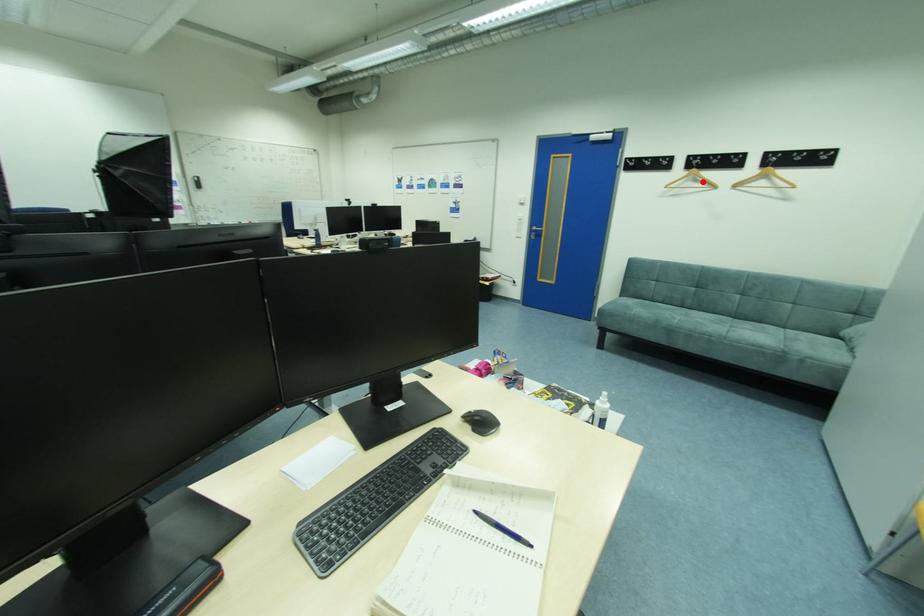
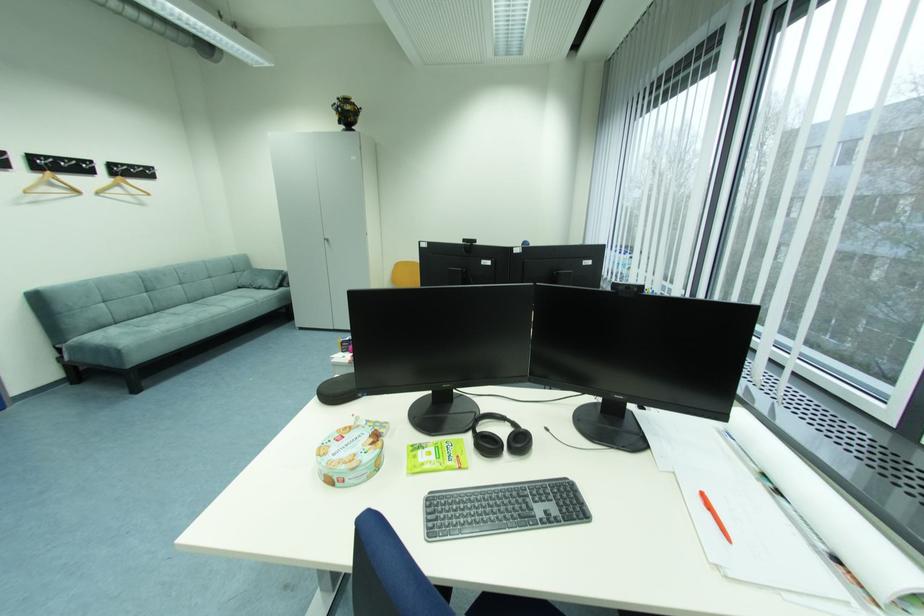
Question: I am providing you with two images of the same scene from different viewpoints. Given a red point in image1, look at the same physical point in image2. Is it:

Choices:
 (A) Closer to the viewpoint
 (B) Farther from the viewpoint

Answer: (B)